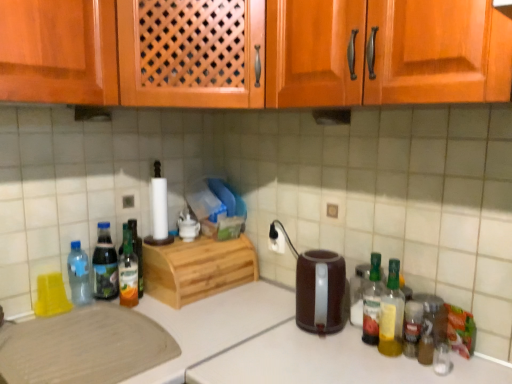
Question: Does translucent plastic bottle at right, the first bottle when ordered from right to left, have a larger size compared to translucent plastic bottle at left, which is counted as the 5th bottle, starting from the right?

Choices:
 (A) yes
 (B) no

Answer: (B)

Question: From the image's perspective, is translucent plastic bottle at right, the first bottle when ordered from right to left, beneath translucent plastic bottle at left, which is counted as the 5th bottle, starting from the right?

Choices:
 (A) yes
 (B) no

Answer: (A)

Question: Is the depth of translucent plastic bottle at right, the first bottle when ordered from right to left, less than that of translucent plastic bottle at left, which is counted as the 5th bottle, starting from the right?

Choices:
 (A) yes
 (B) no

Answer: (A)

Question: Is translucent plastic bottle at right, the first bottle when ordered from right to left, not inside translucent plastic bottle at left, which is counted as the 5th bottle, starting from the right?

Choices:
 (A) yes
 (B) no

Answer: (A)

Question: Does translucent plastic bottle at right, the sixth bottle viewed from the left, have a lesser height compared to translucent plastic bottle at left, which ranks as the second bottle in left-to-right order?

Choices:
 (A) yes
 (B) no

Answer: (A)

Question: Considering their positions, is brown plastic kettle at center located in front of or behind translucent glass bottle at center left, which is the 4th bottle from right to left?

Choices:
 (A) behind
 (B) front

Answer: (B)

Question: In the image, is brown plastic kettle at center on the left side or the right side of translucent glass bottle at center left, which is counted as the third bottle, starting from the left?

Choices:
 (A) left
 (B) right

Answer: (B)

Question: From their relative heights in the image, would you say brown plastic kettle at center is taller or shorter than translucent glass bottle at center left, which is counted as the third bottle, starting from the left?

Choices:
 (A) short
 (B) tall

Answer: (A)

Question: From the image's perspective, is brown plastic kettle at center positioned above or below translucent glass bottle at center left, which is the 4th bottle from right to left?

Choices:
 (A) below
 (B) above

Answer: (A)

Question: Is translucent plastic bottle at left, which ranks as the second bottle in left-to-right order, to the left or to the right of brown plastic kettle at center in the image?

Choices:
 (A) right
 (B) left

Answer: (B)

Question: Is translucent plastic bottle at left, which ranks as the second bottle in left-to-right order, taller or shorter than brown plastic kettle at center?

Choices:
 (A) short
 (B) tall

Answer: (B)

Question: Is point (104, 226) positioned closer to the camera than point (326, 301)?

Choices:
 (A) farther
 (B) closer

Answer: (A)

Question: From the image's perspective, is translucent plastic bottle at left, which ranks as the second bottle in left-to-right order, above or below brown plastic kettle at center?

Choices:
 (A) above
 (B) below

Answer: (A)

Question: Is natural wood breadbox at center, placed as the 2th cabinetry when sorted from top to bottom, taller or shorter than translucent plastic bottle at left, which ranks as the second bottle in left-to-right order?

Choices:
 (A) short
 (B) tall

Answer: (A)

Question: In terms of width, does natural wood breadbox at center, acting as the first cabinetry starting from the bottom, look wider or thinner when compared to translucent plastic bottle at left, which is counted as the 5th bottle, starting from the right?

Choices:
 (A) wide
 (B) thin

Answer: (A)